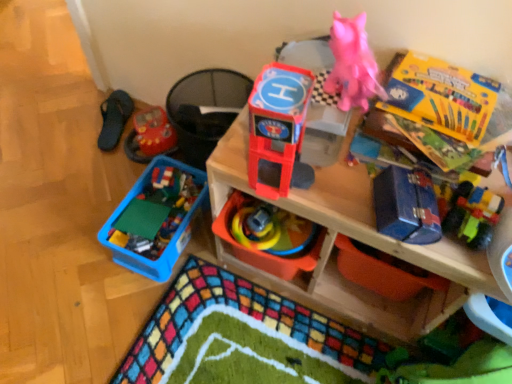
I want to click on vacant point to the left of blue metallic toolbox at right, marked as the second toy in a front-to-back arrangement, so click(337, 194).